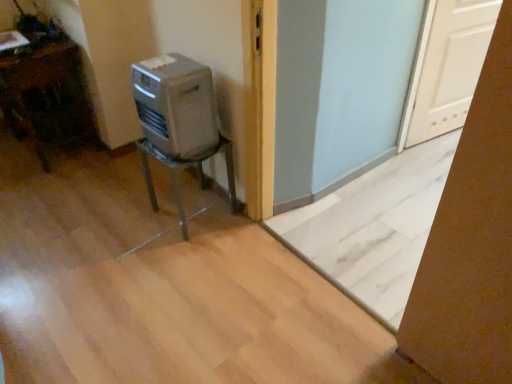
In order to click on vacant region to the left of metallic gray chair at center-left, which appears as the 2th furniture when viewed from the left in this screenshot , I will do `click(132, 219)`.